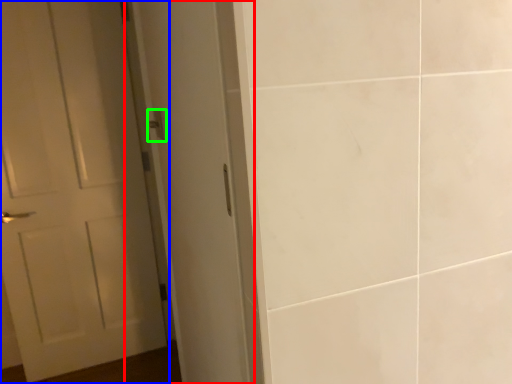
Question: Which is farther away from screen door (highlighted by a red box)? door (highlighted by a blue box) or door handle (highlighted by a green box)?

Choices:
 (A) door
 (B) door handle

Answer: (A)